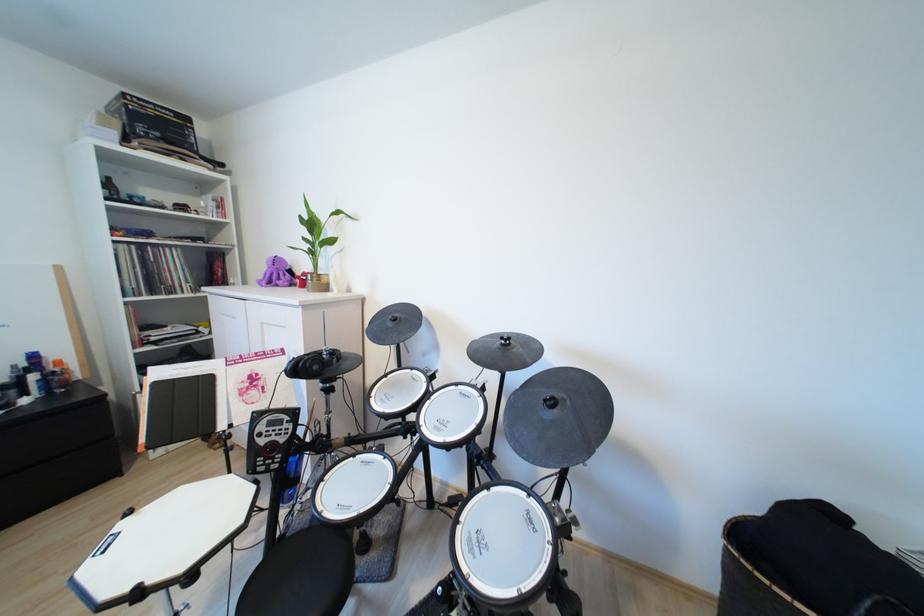
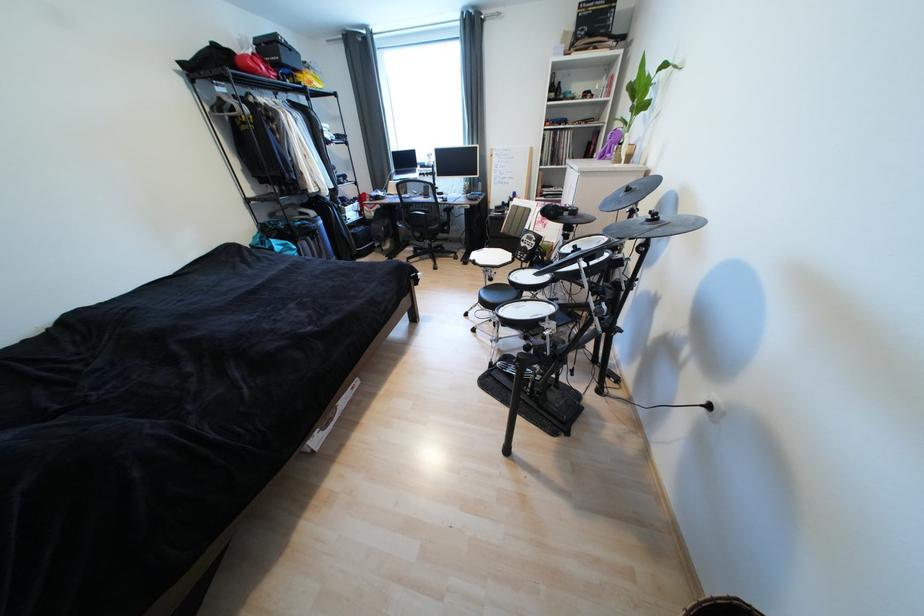
Where in the second image is the point corresponding to point 396,325 from the first image?

(628, 196)